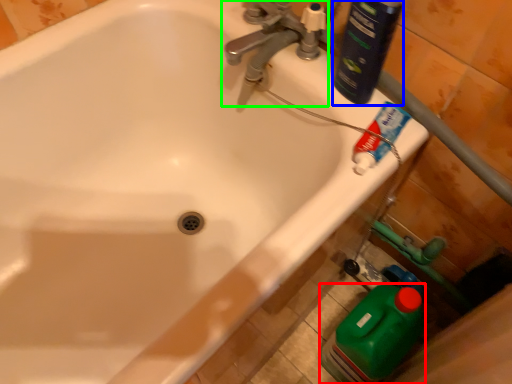
Question: Based on their relative distances, which object is farther from cleaning product (highlighted by a red box)? Choose from cleaning product (highlighted by a blue box) and tap (highlighted by a green box).

Choices:
 (A) cleaning product
 (B) tap

Answer: (B)